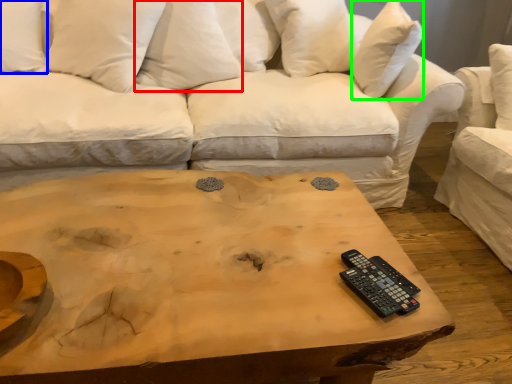
Question: Which object is positioned farthest from pillow (highlighted by a red box)? Select from pillow (highlighted by a blue box) and pillow (highlighted by a green box).

Choices:
 (A) pillow
 (B) pillow

Answer: (B)